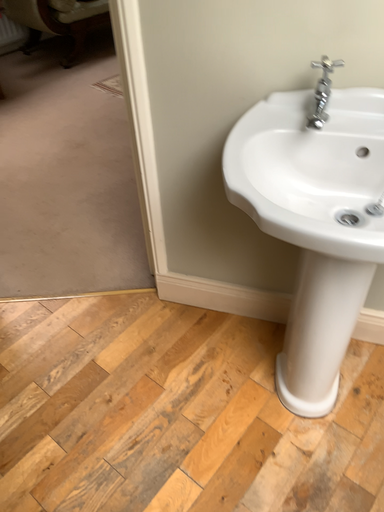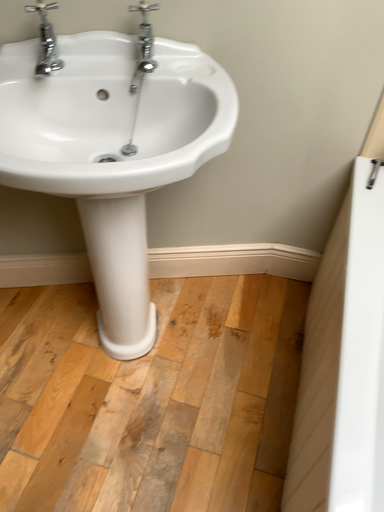
Question: How did the camera likely rotate when shooting the video?

Choices:
 (A) rotated right
 (B) rotated left

Answer: (A)